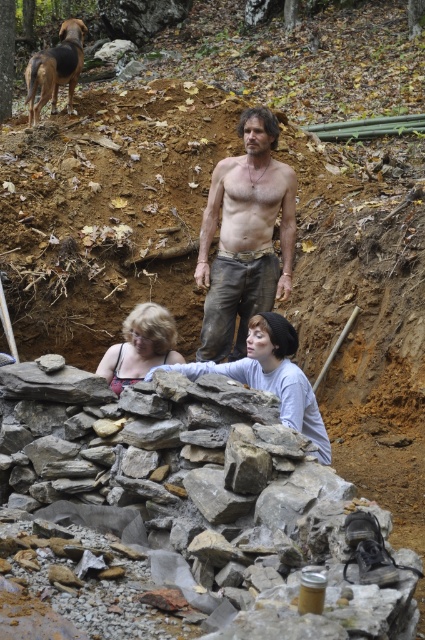
Question: Can you confirm if rough stone wall at center is bigger than matte black tank top at center?

Choices:
 (A) yes
 (B) no

Answer: (A)

Question: Which of these objects is positioned closest to the rough denim pants at center?

Choices:
 (A) matte black tank top at center
 (B) gray rough stone at center
 (C) rough stone wall at center

Answer: (C)

Question: Does rough denim pants at center have a lesser width compared to rough stone wall at center?

Choices:
 (A) yes
 (B) no

Answer: (A)

Question: Is gray rough stone at center wider than rough stone wall at center?

Choices:
 (A) no
 (B) yes

Answer: (B)

Question: Estimate the real-world distances between objects in this image. Which object is closer to the gray rough stone at center?

Choices:
 (A) rough stone wall at center
 (B) rough denim pants at center
 (C) matte black tank top at center

Answer: (A)

Question: Considering the real-world distances, which object is closest to the rough stone wall at center?

Choices:
 (A) rough denim pants at center
 (B) matte black tank top at center

Answer: (B)